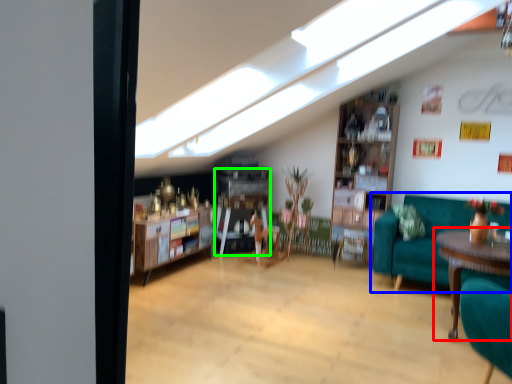
Question: Based on their relative distances, which object is nearer to table (highlighted by a red box)? Choose from studio couch (highlighted by a blue box) and shelf (highlighted by a green box).

Choices:
 (A) studio couch
 (B) shelf

Answer: (A)